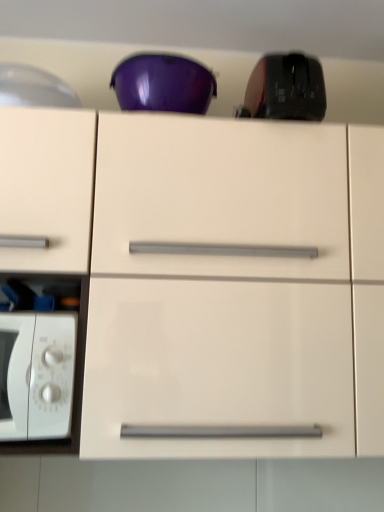
Question: From their relative heights in the image, would you say white glossy microwave oven at left is taller or shorter than glossy white cabinet at center?

Choices:
 (A) short
 (B) tall

Answer: (A)

Question: Is white glossy microwave oven at left inside the boundaries of glossy white cabinet at center, or outside?

Choices:
 (A) inside
 (B) outside

Answer: (A)

Question: Which is nearer to the glossy white cabinet at center?

Choices:
 (A) black matte mouse at upper right
 (B) white glossy microwave oven at left

Answer: (B)

Question: Considering the real-world distances, which object is farthest from the glossy white cabinet at center?

Choices:
 (A) black matte mouse at upper right
 (B) white glossy microwave oven at left

Answer: (A)